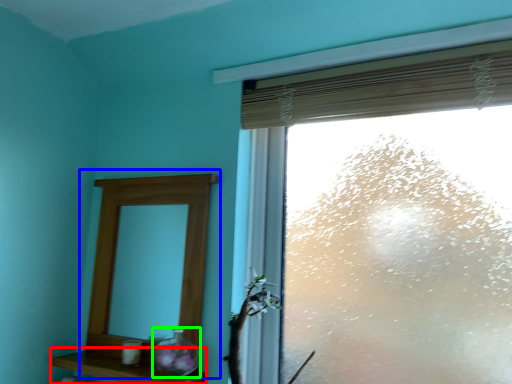
Question: Based on their relative distances, which object is nearer to shelf (highlighted by a red box)? Choose from medicine cabinet (highlighted by a blue box) and glass vase (highlighted by a green box).

Choices:
 (A) medicine cabinet
 (B) glass vase

Answer: (B)